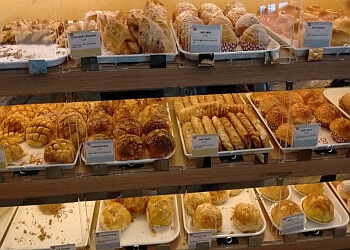
I want to click on yellow wall in the background, so click(71, 5).